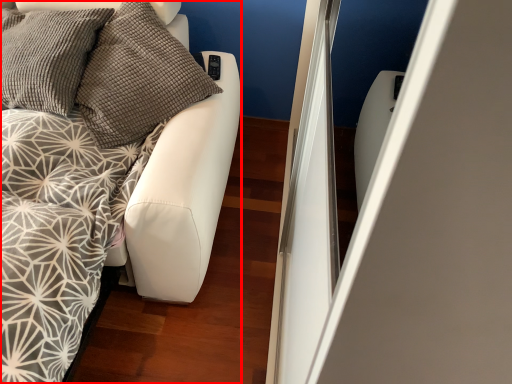
Question: From the image's perspective, what is the correct spatial positioning of furniture (annotated by the red box) in reference to pillow?

Choices:
 (A) above
 (B) below

Answer: (B)